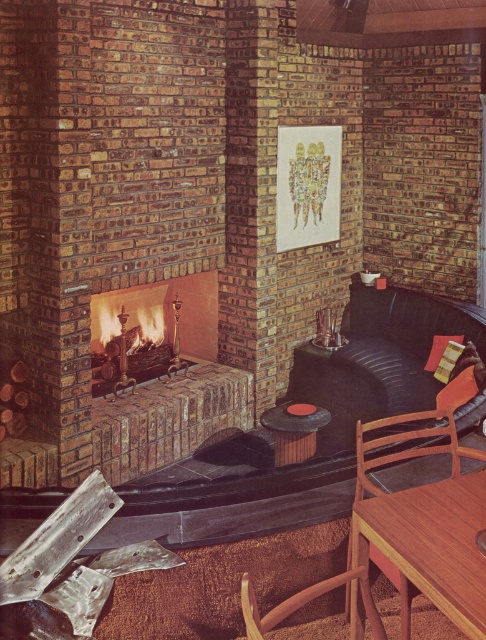
Can you confirm if black leather couch at center is wider than brick fireplace at center?

Correct, the width of black leather couch at center exceeds that of brick fireplace at center.

Can you confirm if black leather couch at center is shorter than brick fireplace at center?

Incorrect, black leather couch at center's height does not fall short of brick fireplace at center's.

Between point (443, 332) and point (210, 346), which one is positioned behind?

The point (443, 332) is behind.

The height and width of the screenshot is (640, 486). I want to click on black leather couch at center, so click(380, 358).

Does teak wood table at lower right have a smaller size compared to brick fireplace at center?

Yes.

Between teak wood table at lower right and brick fireplace at center, which one appears on the right side from the viewer's perspective?

Positioned to the right is teak wood table at lower right.

Where is `teak wood table at lower right`? teak wood table at lower right is located at coordinates (433, 541).

Identify the location of teak wood table at lower right. (433, 541).

Between point (172, 280) and point (242, 593), which one is positioned in front?

Point (242, 593) is more forward.

Is point (121, 323) less distant than point (294, 600)?

No, (121, 323) is further to viewer.

Image resolution: width=486 pixels, height=640 pixels. Find the location of `brick fireplace at center`. brick fireplace at center is located at coordinates (153, 330).